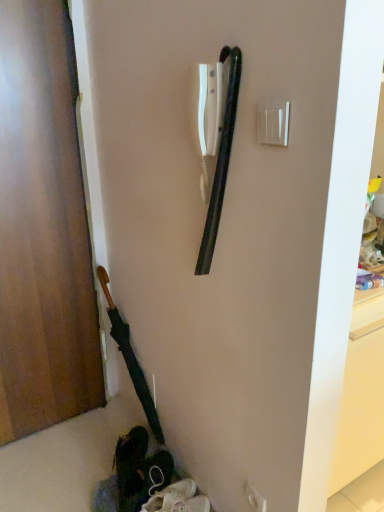
The width and height of the screenshot is (384, 512). What do you see at coordinates (43, 228) in the screenshot?
I see `wooden door at left` at bounding box center [43, 228].

What are the coordinates of `white plastic light switch at upper right` in the screenshot? It's located at (273, 123).

From a real-world perspective, which is physically above, wooden door at left or white plastic electric outlet at center?

From a 3D spatial view, wooden door at left is above.

Between wooden door at left and white plastic electric outlet at center, which one appears on the right side from the viewer's perspective?

white plastic electric outlet at center.

Is wooden door at left positioned with its back to white plastic electric outlet at center?

wooden door at left is not turned away from white plastic electric outlet at center.

Locate an element on the screen. This screenshot has height=512, width=384. door in front of the white plastic electric outlet at center is located at coordinates (43, 228).

How much distance is there between white plastic light switch at upper right and wooden door at left?

The distance of white plastic light switch at upper right from wooden door at left is 1.15 meters.

Which object is thinner, white plastic light switch at upper right or wooden door at left?

Thinner between the two is white plastic light switch at upper right.

Is white plastic light switch at upper right oriented towards wooden door at left?

No, white plastic light switch at upper right is not turned towards wooden door at left.

Does point (286, 144) come farther from viewer compared to point (3, 97)?

That is False.

Would you say white plastic electric outlet at center contains wooden door at left?

That's incorrect, wooden door at left is not inside white plastic electric outlet at center.

Considering the sizes of objects white plastic electric outlet at center and wooden door at left in the image provided, who is thinner, white plastic electric outlet at center or wooden door at left?

white plastic electric outlet at center is thinner.

From the image's perspective, which one is positioned lower, white plastic electric outlet at center or wooden door at left?

white plastic electric outlet at center appears lower in the image.

Is white plastic electric outlet at center in front of or behind wooden door at left in the image?

In the image, white plastic electric outlet at center appears behind wooden door at left.

Based on the photo, considering the relative sizes of white plastic light switch at upper right and white plastic electric outlet at center in the image provided, is white plastic light switch at upper right smaller than white plastic electric outlet at center?

Yes.

Considering the sizes of objects white plastic light switch at upper right and white plastic electric outlet at center in the image provided, who is taller, white plastic light switch at upper right or white plastic electric outlet at center?

With more height is white plastic light switch at upper right.

Is white plastic light switch at upper right turned away from white plastic electric outlet at center?

No, white plastic light switch at upper right's orientation is not away from white plastic electric outlet at center.

From the image's perspective, is white plastic electric outlet at center under white plastic light switch at upper right?

Yes, from the image's perspective, white plastic electric outlet at center is below white plastic light switch at upper right.

At what (x,y) coordinates should I click in order to perform the action: click on light switch above the white plastic electric outlet at center (from the image's perspective). Please return your answer as a coordinate pair (x, y). Looking at the image, I should click on (273, 123).

Consider the image. Considering the sizes of objects white plastic electric outlet at center and white plastic light switch at upper right in the image provided, who is wider, white plastic electric outlet at center or white plastic light switch at upper right?

white plastic electric outlet at center is wider.

Is white plastic electric outlet at center situated inside white plastic light switch at upper right or outside?

white plastic electric outlet at center is spatially situated outside white plastic light switch at upper right.

From the image's perspective, does wooden door at left appear higher than white plastic light switch at upper right?

No.

Considering the sizes of objects wooden door at left and white plastic light switch at upper right in the image provided, who is taller, wooden door at left or white plastic light switch at upper right?

wooden door at left.

Could you tell me if wooden door at left is turned towards white plastic light switch at upper right?

Yes.

How different are the orientations of wooden door at left and white plastic light switch at upper right in degrees?

The angle between the facing direction of wooden door at left and the facing direction of white plastic light switch at upper right is 90.3 degrees.

I want to click on door in front of the white plastic electric outlet at center, so click(x=43, y=228).

Where is `door located on the left of white plastic light switch at upper right`? Image resolution: width=384 pixels, height=512 pixels. door located on the left of white plastic light switch at upper right is located at coordinates (43, 228).

Based on their spatial positions, is white plastic electric outlet at center or wooden door at left further from white plastic light switch at upper right?

Among the two, wooden door at left is located further to white plastic light switch at upper right.

Which object lies further to the anchor point wooden door at left, white plastic electric outlet at center or white plastic light switch at upper right?

The object further to wooden door at left is white plastic electric outlet at center.

Looking at the image, which one is located closer to white plastic light switch at upper right, wooden door at left or white plastic electric outlet at center?

Based on the image, white plastic electric outlet at center appears to be nearer to white plastic light switch at upper right.

From the image, which object appears to be nearer to wooden door at left, white plastic light switch at upper right or white plastic electric outlet at center?

Based on the image, white plastic light switch at upper right appears to be nearer to wooden door at left.

From the image, which object appears to be nearer to white plastic electric outlet at center, white plastic light switch at upper right or wooden door at left?

white plastic light switch at upper right is closer to white plastic electric outlet at center.

Estimate the real-world distances between objects in this image. Which object is further from white plastic electric outlet at center, wooden door at left or white plastic light switch at upper right?

wooden door at left lies further to white plastic electric outlet at center than the other object.

Where is `door between white plastic light switch at upper right and white plastic electric outlet at center vertically`? The image size is (384, 512). door between white plastic light switch at upper right and white plastic electric outlet at center vertically is located at coordinates (43, 228).